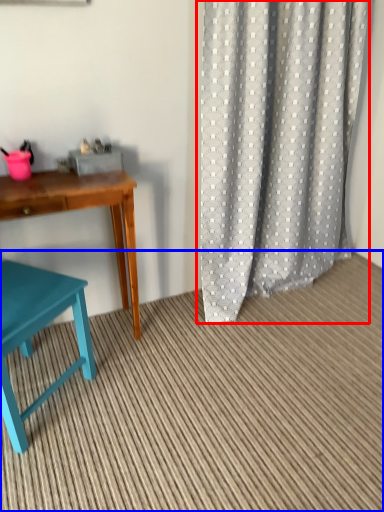
Question: Which object appears closest to the camera in this image, curtain (highlighted by a red box) or plain (highlighted by a blue box)?

Choices:
 (A) curtain
 (B) plain

Answer: (B)